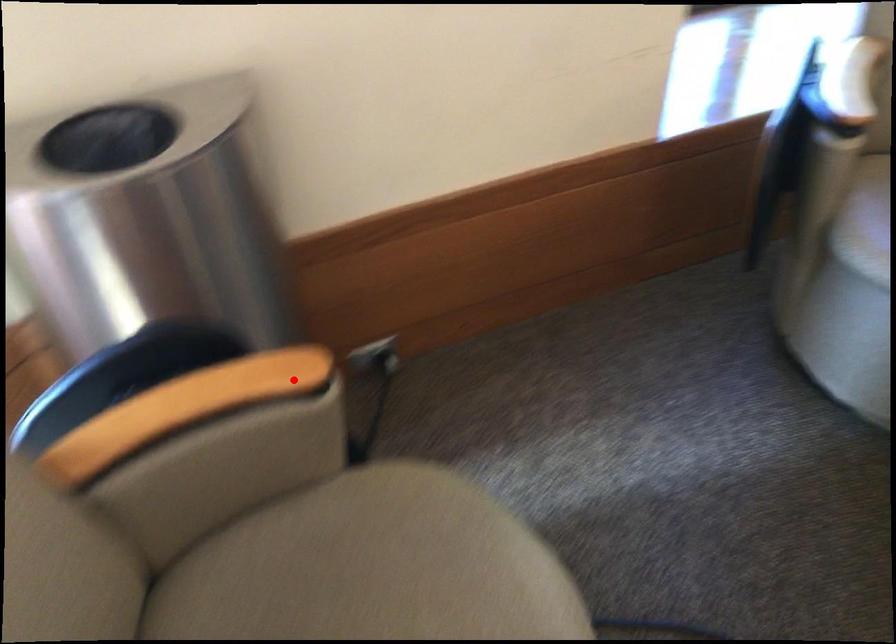
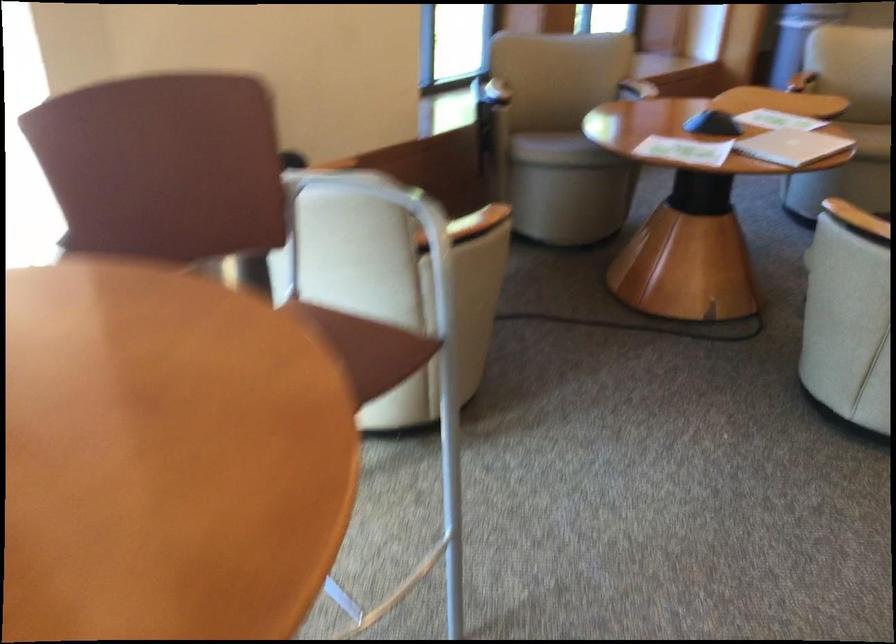
Find the pixel in the second image that matches the highlighted location in the first image.

(333, 164)